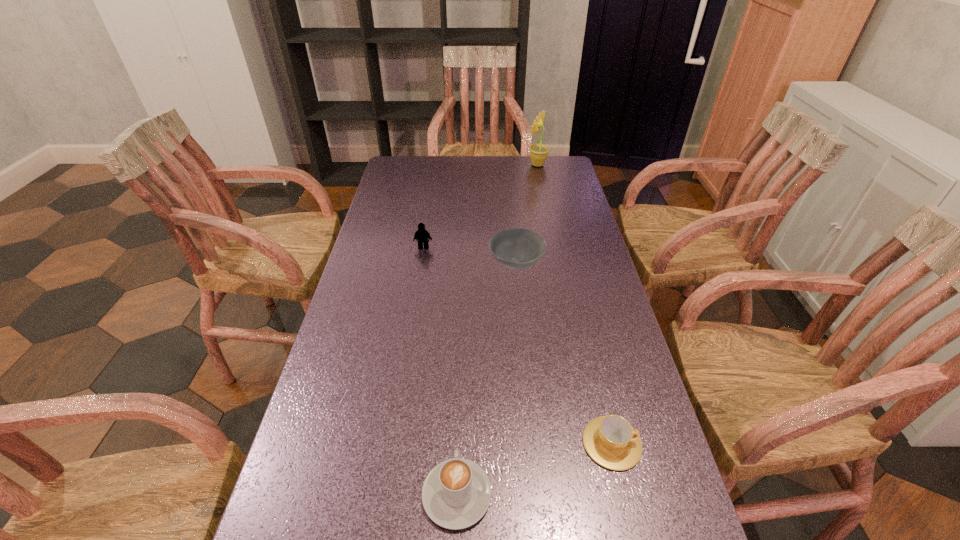
Where is `vacant space that's between the cup and the bowl`? The image size is (960, 540). vacant space that's between the cup and the bowl is located at coordinates (564, 353).

Find the location of `blank region between the bowl and the cup`. blank region between the bowl and the cup is located at coordinates click(564, 353).

The height and width of the screenshot is (540, 960). Find the location of `free space between the cappuccino and the Lego`. free space between the cappuccino and the Lego is located at coordinates (441, 371).

Select which object appears as the closest to the bowl. Please provide its 2D coordinates. Your answer should be formatted as a tuple, i.e. [(x, y)], where the tuple contains the x and y coordinates of a point satisfying the conditions above.

[(423, 236)]

This screenshot has width=960, height=540. In order to click on object identified as the fourth closest to the cup in this screenshot , I will do `click(538, 152)`.

Find the location of a particular element. This screenshot has height=540, width=960. blank space that satisfies the following two spatial constraints: 1. on the face of the bowl; 2. on the right side of the Lego is located at coordinates (420, 263).